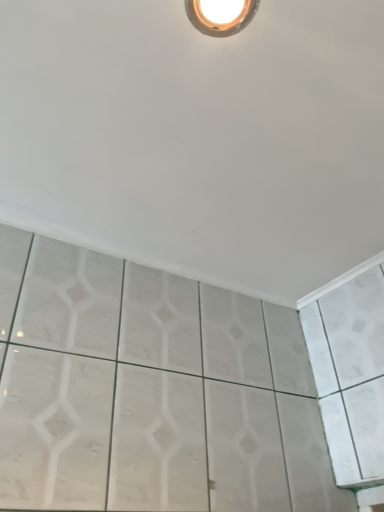
What is the approximate height of matte white light fixture at upper center?

0.39 inches.

Locate an element on the screen. This screenshot has width=384, height=512. matte white light fixture at upper center is located at coordinates (221, 15).

Image resolution: width=384 pixels, height=512 pixels. What do you see at coordinates (221, 15) in the screenshot?
I see `matte white light fixture at upper center` at bounding box center [221, 15].

Where is `matte white light fixture at upper center`? Image resolution: width=384 pixels, height=512 pixels. matte white light fixture at upper center is located at coordinates (221, 15).